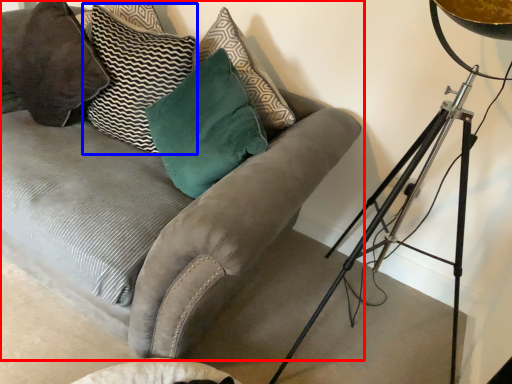
Question: Which point is closer to the camera, studio couch (highlighted by a red box) or pillow (highlighted by a blue box)?

Choices:
 (A) studio couch
 (B) pillow

Answer: (A)